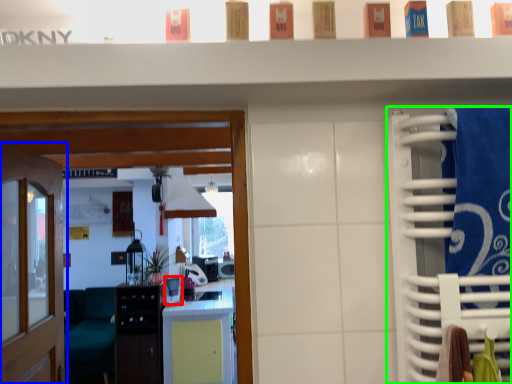
Question: Which object is positioned farthest from appliance (highlighted by a red box)? Select from door (highlighted by a blue box) and closet (highlighted by a green box).

Choices:
 (A) door
 (B) closet

Answer: (B)